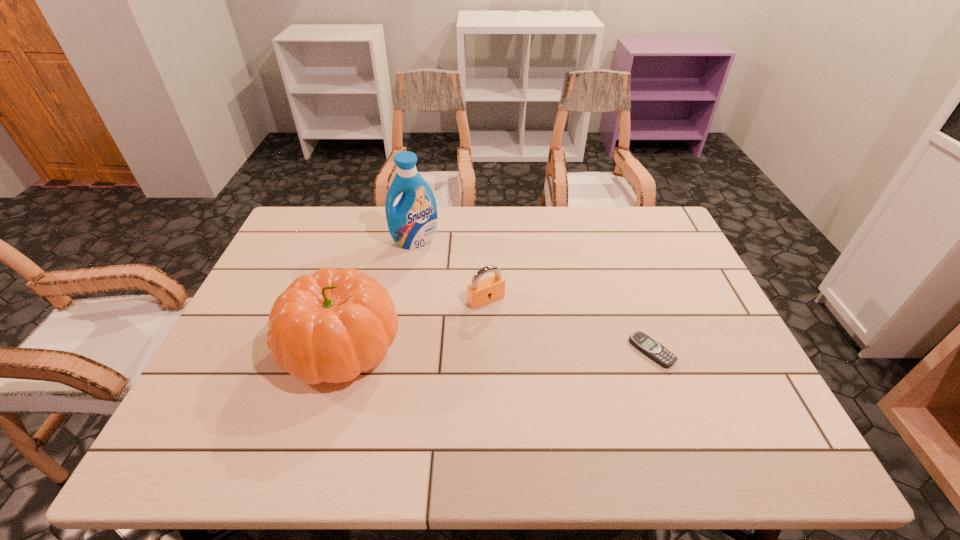
The width and height of the screenshot is (960, 540). I want to click on blank space located on the front-facing side of the detergent, so click(433, 287).

Image resolution: width=960 pixels, height=540 pixels. I want to click on vacant space located on the front-facing side of the detergent, so click(452, 344).

The height and width of the screenshot is (540, 960). In order to click on free region located to unlock the padlock from the front in this screenshot , I will do `click(561, 387)`.

Identify the location of free space located 0.360m to unlock the padlock from the front. pos(580,411).

At what (x,y) coordinates should I click in order to perform the action: click on vacant region located 0.240m to unlock the padlock from the front. Please return your answer as a coordinate pair (x, y). The width and height of the screenshot is (960, 540). Looking at the image, I should click on (547, 372).

Where is `object present at the far edge`? This screenshot has height=540, width=960. object present at the far edge is located at coordinates (412, 222).

Where is `object at the near edge`? This screenshot has height=540, width=960. object at the near edge is located at coordinates (330, 326).

You are a GUI agent. You are given a task and a screenshot of the screen. Output one action in this format:
    pyautogui.click(x=<x>, y=<y>)
    Task: Click on the object that is at the left edge
    This screenshot has height=540, width=960.
    Given the screenshot: What is the action you would take?
    pyautogui.click(x=330, y=326)

Locate an element on the screen. Image resolution: width=960 pixels, height=540 pixels. object present at the near left corner is located at coordinates (330, 326).

The height and width of the screenshot is (540, 960). In the image, there is a desktop. What are the coordinates of `vacant space at the far edge` in the screenshot? It's located at (591, 215).